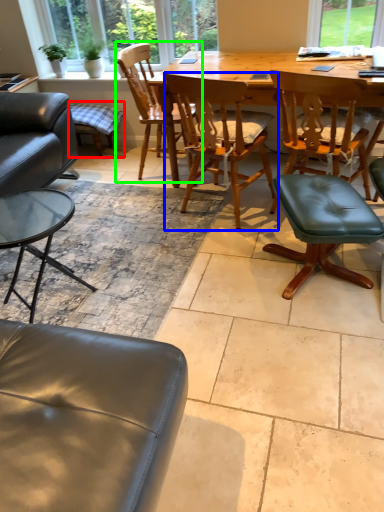
Question: Estimate the real-world distances between objects in this image. Which object is farther from bar stool (highlighted by a red box), chair (highlighted by a blue box) or chair (highlighted by a green box)?

Choices:
 (A) chair
 (B) chair

Answer: (A)